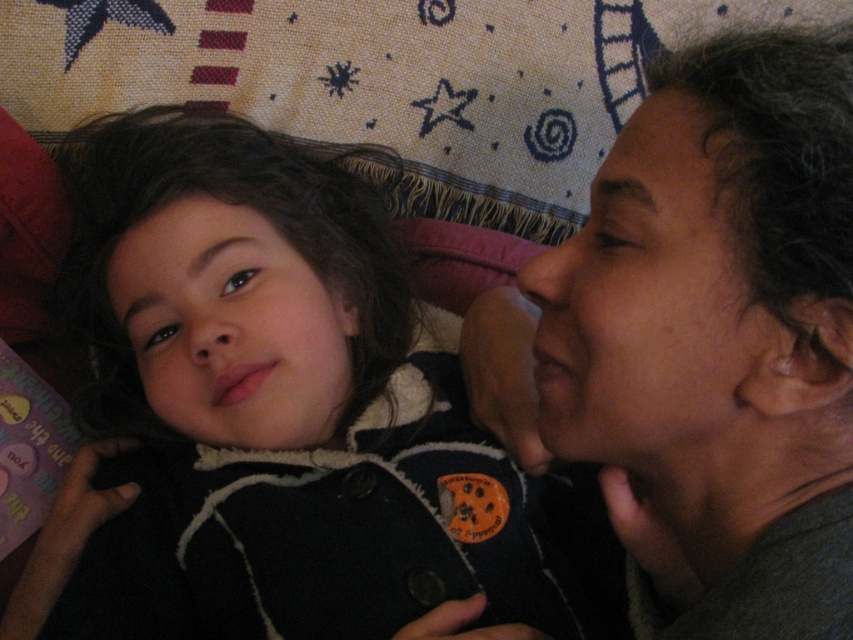
You are a photographer taking a portrait of the dark gray hair at right and the smooth skin face at center. Which object should you focus on first if you want to capture both in the frame without moving the camera?

You should focus on the smooth skin face at center first because it is wider than the dark gray hair at right, ensuring it fits well within the frame.

In the image, there is a point labeled at coordinates (718, 336). Based on the scene description, what does this point correspond to?

The point at (718, 336) corresponds to the dark gray hair at the right side of the frame.

You are standing in front of the image and want to touch the two points mentioned. Which point, point (624, 429) or point (310, 300), is closer to you?

Point (624, 429) is closer to the viewer than point (310, 300).